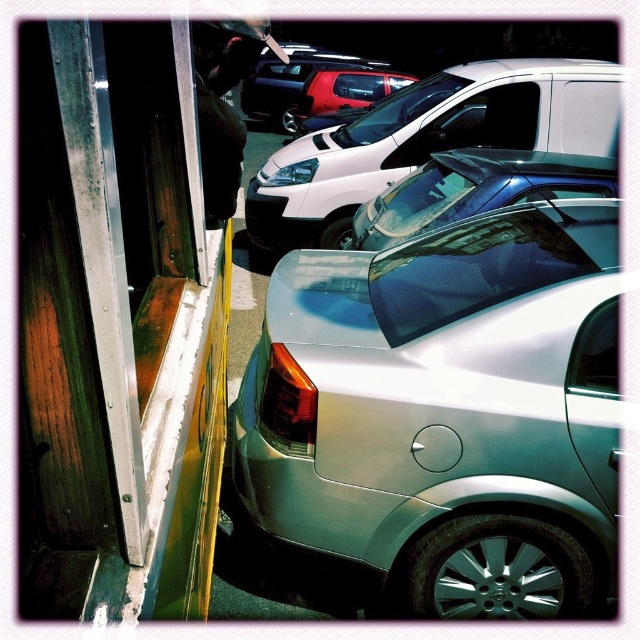
You are a delivery person trying to park your truck in the parking lot. You see the satin silver car at center and the satin white van at center. Which vehicle should you avoid parking too close to if you want to leave first?

You should avoid parking too close to the satin white van at center because it is larger in size compared to the satin silver car at center, which means it might require more space to maneuver out of the parking spot.

You are a delivery driver who needs to park your truck between the satin silver car at center and the satin white van at center. Given that your truck is 2.5 meters wide, can you safely park between them without touching either vehicle?

The satin silver car at center has a lesser width compared to satin white van at center. Since the truck is 2.5 meters wide, it depends on the actual distance between the two vehicles. However, the description only mentions their widths, not the space between them. Therefore, insufficient information is provided to determine if parking is possible.

You are standing in the parking lot and want to determine which of the two points, point [394,227] or point [272,76], is nearer to you. Based on the scene, which point is closer?

Point [394,227] is closer to you than point [272,76].